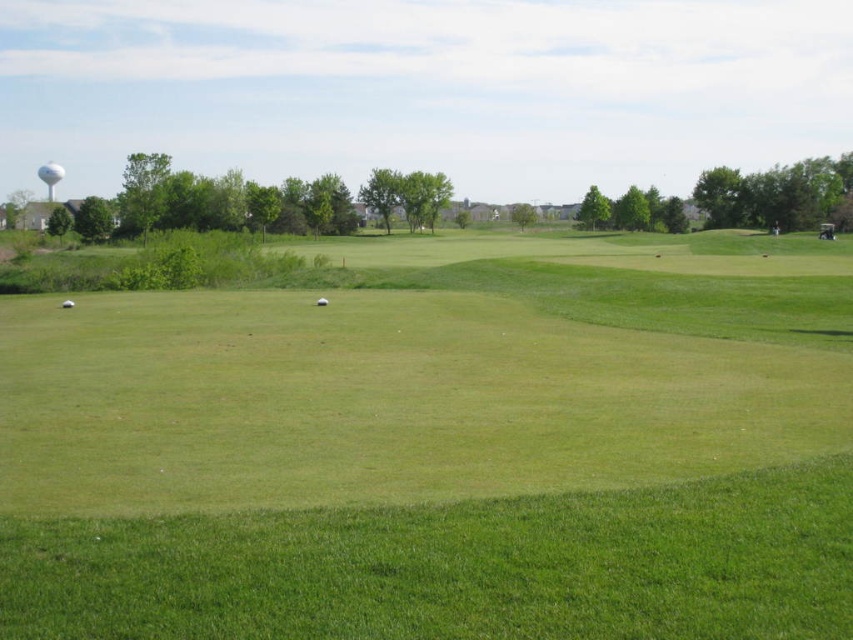
From the picture: You are a golfer standing at the tee area and want to hit your ball to the green grassy field at center. Based on the coordinates provided in the scene description, in which direction should you aim your shot?

The green grassy field at center is located at coordinates point [440,445], so you should aim your shot towards the center of the image to reach the green grassy field at center.

You are a golfer standing at the center of the fairway and see the white matte golf ball at lower left. Based on its position, which direction should you walk to retrieve it?

The white matte golf ball at lower left is located at point (67, 304), which means it is positioned to the left and slightly forward from your current position at the center. You should walk diagonally towards the lower left direction to retrieve it.